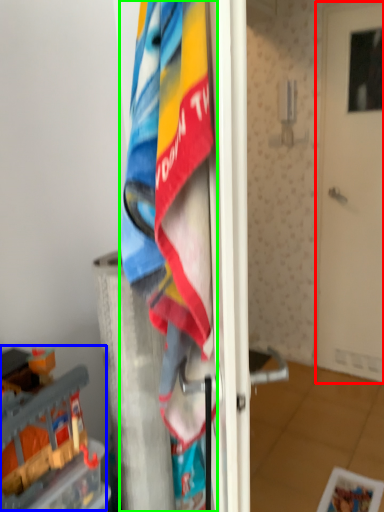
Question: Considering the real-world distances, which object is farthest from door (highlighted by a red box)? toy (highlighted by a blue box) or towel (highlighted by a green box)?

Choices:
 (A) toy
 (B) towel

Answer: (B)